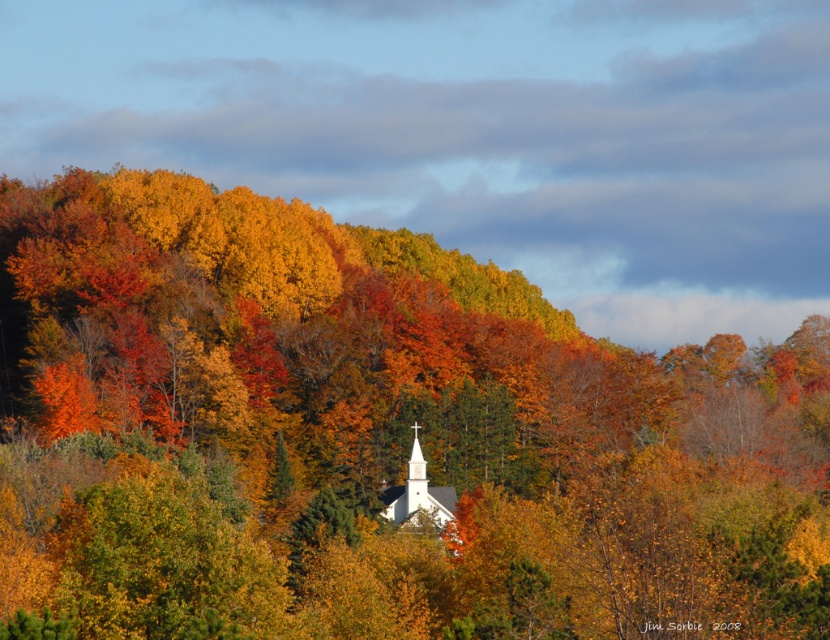
Between matte orange tree at center and white smooth chapel at center, which one has less height?

white smooth chapel at center

Between matte orange tree at center and white smooth chapel at center, which one appears on the left side from the viewer's perspective?

Positioned to the left is white smooth chapel at center.

The image size is (830, 640). What do you see at coordinates (374, 436) in the screenshot?
I see `matte orange tree at center` at bounding box center [374, 436].

Locate an element on the screen. matte orange tree at center is located at coordinates (374, 436).